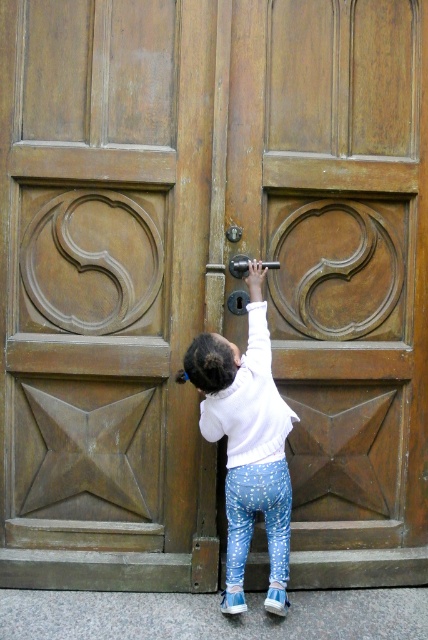
You are a parent watching your child try to reach the door handle. The child is wearing a white soft sweater at center and reaching for the polished brass door handle at center. Which item is larger in size?

The white soft sweater at center is bigger than the polished brass door handle at center.

The child is wearing a white soft sweater at center and trying to reach the polished brass door handle at center. Based on their clothing, which item is taller?

The white soft sweater at center is taller than the polished brass door handle at center.

You are a photographer trying to capture the child reaching for the door handle. Based on the scene, can you determine which object, the white soft sweater at center or the polished brass door handle at center, is closer to the camera?

The white soft sweater at center is positioned on the right side of the polished brass door handle at center, so the white soft sweater at center is closer to the camera.